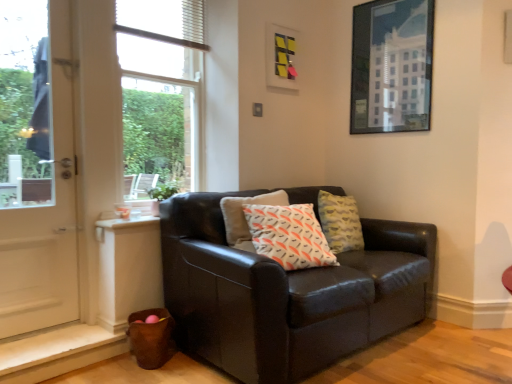
Question: Does point (423, 120) appear closer or farther from the camera than point (19, 157)?

Choices:
 (A) farther
 (B) closer

Answer: (B)

Question: In terms of size, does metallic glass picture frame at upper right, the first picture frame in the right-to-left sequence, appear bigger or smaller than white glossy door at left?

Choices:
 (A) small
 (B) big

Answer: (A)

Question: Estimate the real-world distances between objects in this image. Which object is farther from the metallic glass picture frame at upper right, marked as the second picture frame in a left-to-right arrangement?

Choices:
 (A) white glossy door at left
 (B) matte black couch at center
 (C) clear glass window at upper left
 (D) white textured blind at upper center
 (E) yellow matte picture frame at upper center, arranged as the 2th picture frame when viewed from the right

Answer: (A)

Question: Which object is positioned farthest from the white textured blind at upper center?

Choices:
 (A) yellow matte picture frame at upper center, the 1th picture frame from the left
 (B) metallic glass picture frame at upper right, marked as the second picture frame in a left-to-right arrangement
 (C) clear glass window at upper left
 (D) white glossy door at left
 (E) matte black couch at center

Answer: (E)